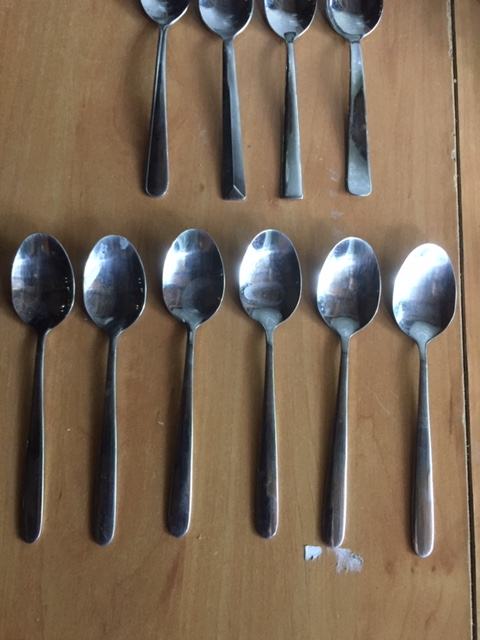
The height and width of the screenshot is (640, 480). I want to click on spoons, so click(158, 82), click(227, 90), click(287, 92), click(356, 91), click(39, 401), click(106, 393), click(183, 400), click(265, 399), click(338, 410), click(419, 418).